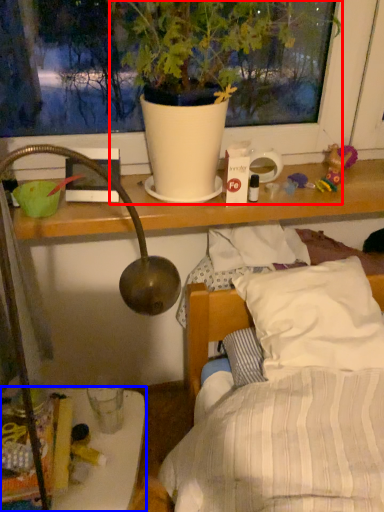
Question: Which of the following is the farthest to the observer, houseplant (highlighted by a red box) or furniture (highlighted by a blue box)?

Choices:
 (A) houseplant
 (B) furniture

Answer: (B)